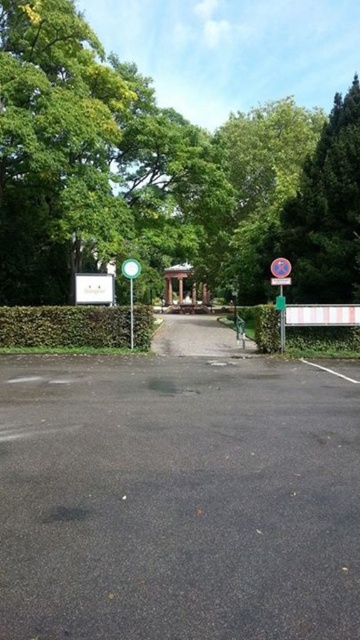
Does metallic circular sign at right appear on the right side of metallic circular stop sign at center?

Indeed, metallic circular sign at right is positioned on the right side of metallic circular stop sign at center.

What do you see at coordinates (281, 291) in the screenshot? I see `metallic circular sign at right` at bounding box center [281, 291].

The width and height of the screenshot is (360, 640). Identify the location of metallic circular sign at right. (281, 291).

Between point (15, 440) and point (128, 260), which one is positioned in front?

Point (15, 440)

Does point (136, 369) come in front of point (128, 273)?

That is True.

Locate an element on the screen. The height and width of the screenshot is (640, 360). black asphalt parking lot at center is located at coordinates (177, 499).

Does metallic circular stop sign at center come in front of green plastic signpost at center?

No, metallic circular stop sign at center is further to the viewer.

Who is higher up, metallic circular stop sign at center or green plastic signpost at center?

Positioned higher is metallic circular stop sign at center.

Image resolution: width=360 pixels, height=640 pixels. Find the location of `metallic circular stop sign at center`. metallic circular stop sign at center is located at coordinates (281, 268).